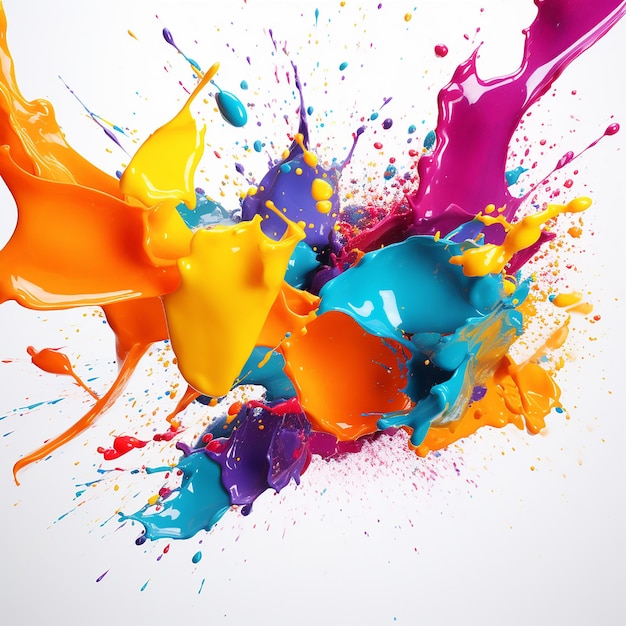
At what (x,y) coordinates should I click in order to perform the action: click on light. Please return your answer as a coordinate pair (x, y). The image size is (626, 626). Looking at the image, I should click on click(237, 250).